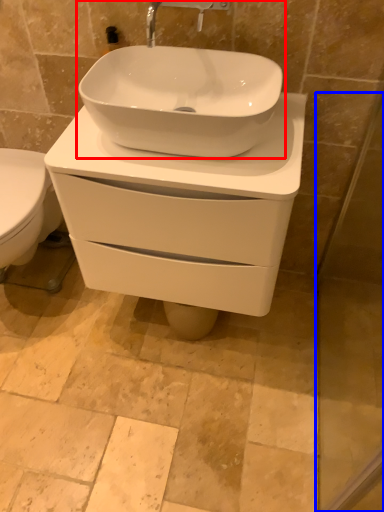
Question: Which object is further to the camera taking this photo, sink (highlighted by a red box) or screen door (highlighted by a blue box)?

Choices:
 (A) sink
 (B) screen door

Answer: (A)